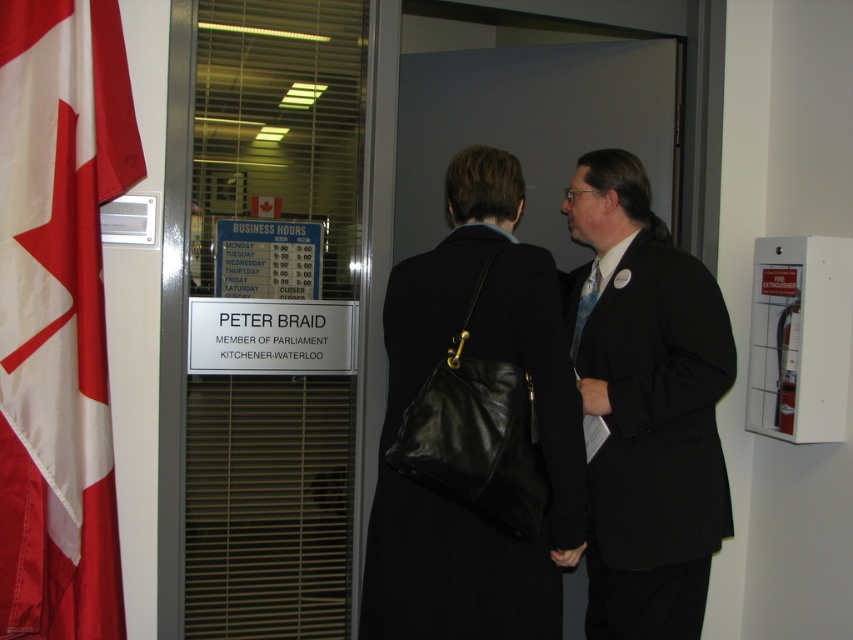
Question: Does matte black coat at center appear on the left side of blue patterned tie at center?

Choices:
 (A) no
 (B) yes

Answer: (A)

Question: Can you confirm if matte black coat at center is positioned below black leather handbag at center?

Choices:
 (A) yes
 (B) no

Answer: (A)

Question: Which point is farther to the camera?

Choices:
 (A) matte black coat at center
 (B) blue patterned tie at center

Answer: (B)

Question: Estimate the real-world distances between objects in this image. Which object is closer to the black leather handbag at center?

Choices:
 (A) matte black coat at center
 (B) blue patterned tie at center
 (C) red cloth flag at left

Answer: (A)

Question: Is red cloth flag at left above blue patterned tie at center?

Choices:
 (A) yes
 (B) no

Answer: (B)

Question: Among these points, which one is farthest from the camera?

Choices:
 (A) (668, 291)
 (B) (4, 625)
 (C) (401, 372)

Answer: (A)